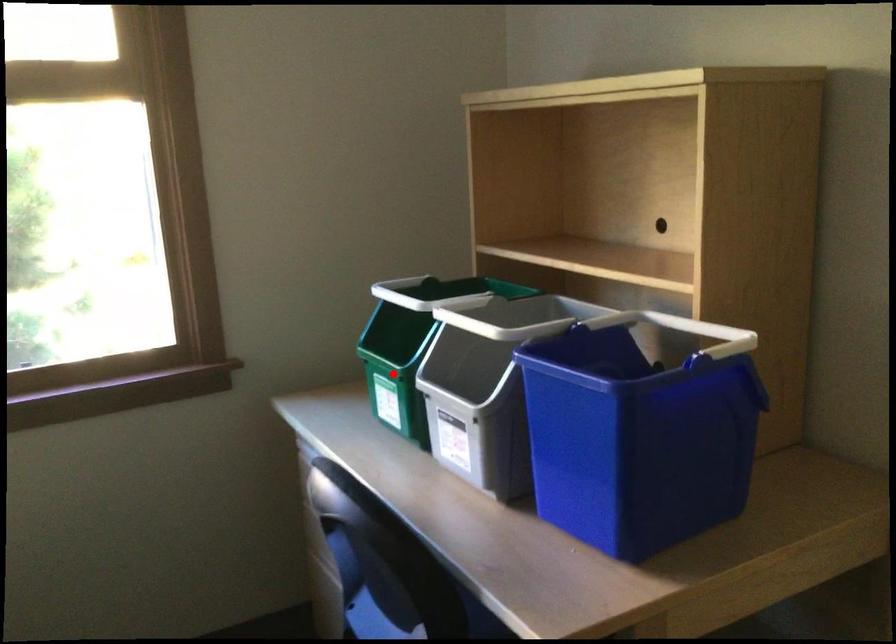
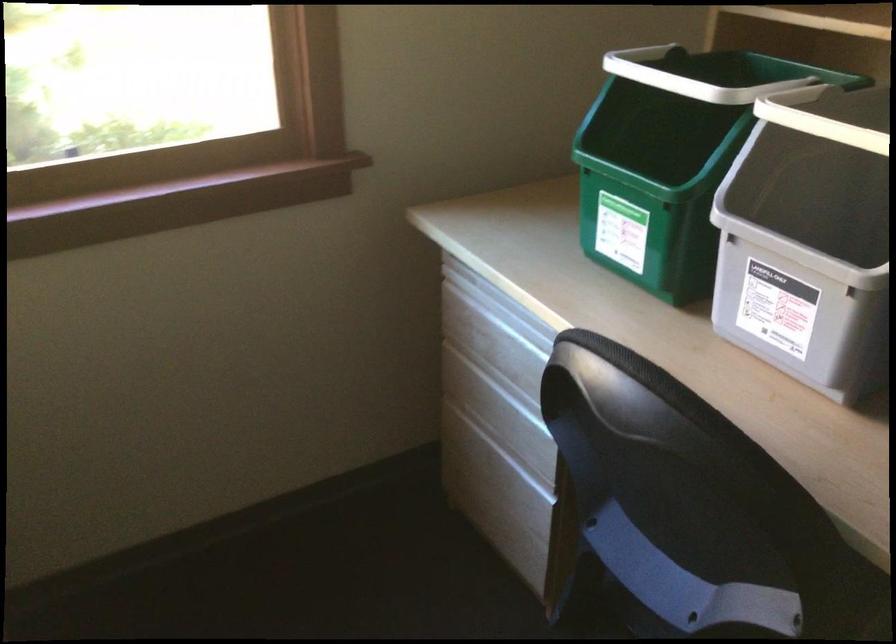
Find the pixel in the second image that matches the highlighted location in the first image.

(652, 194)